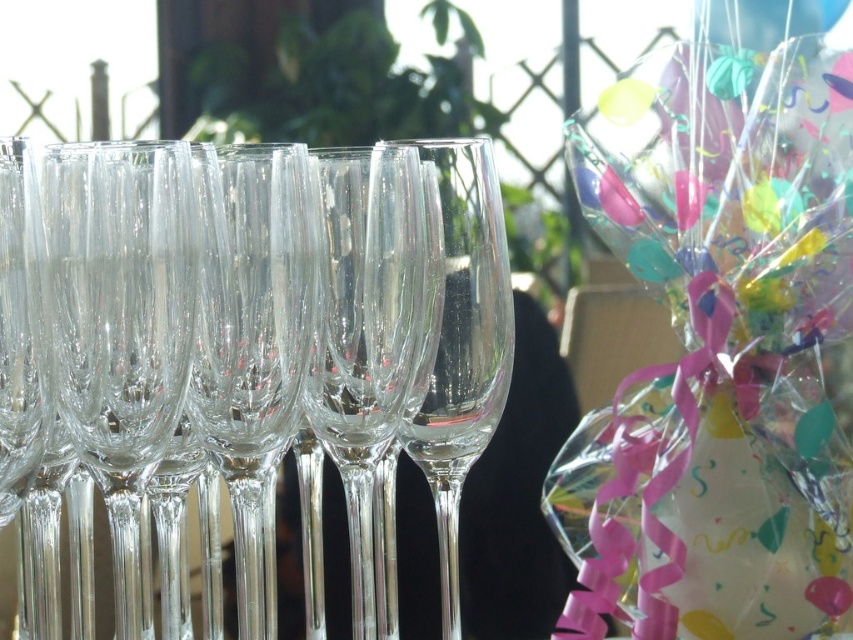
You are a photographer adjusting the focus on your camera. You need to focus on either the point at point (849,109) or the point at point (354,561). Which point should you focus on to capture the closest object in the scene?

Point (849,109) is closer to the camera than point (354,561), so you should focus on point (849,109) to capture the closest object in the scene.

From the picture: You are at a party and want to grab the transparent glass wine glass at center without popping the translucent plastic balloon at upper right. What should you do first?

The translucent plastic balloon at upper right is in front of the transparent glass wine glass at center, so you should move the translucent plastic balloon at upper right out of the way first to access the transparent glass wine glass at center safely.

You are at a party and want to reach the translucent plastic balloon at upper right without touching the champagne flutes. The flutes are arranged in a straight line from left to right. If you move directly from your current position at the point marked by coordinates point [718,349], will you collide with any of the champagne flutes?

The point [718,349] corresponds to the translucent plastic balloon at upper right, so moving directly from there would not collide with the champagne flutes since the flutes are arranged to the left of the balloon.